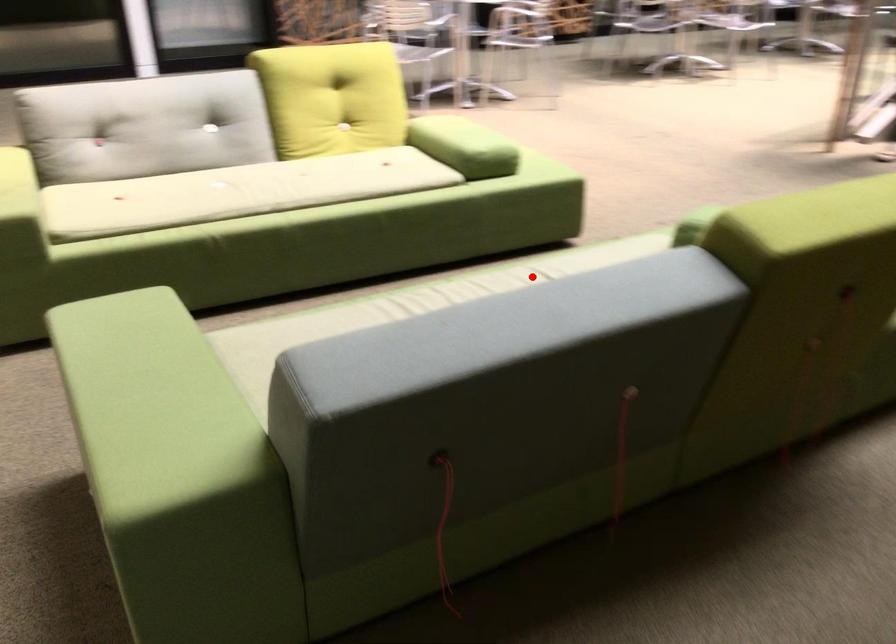
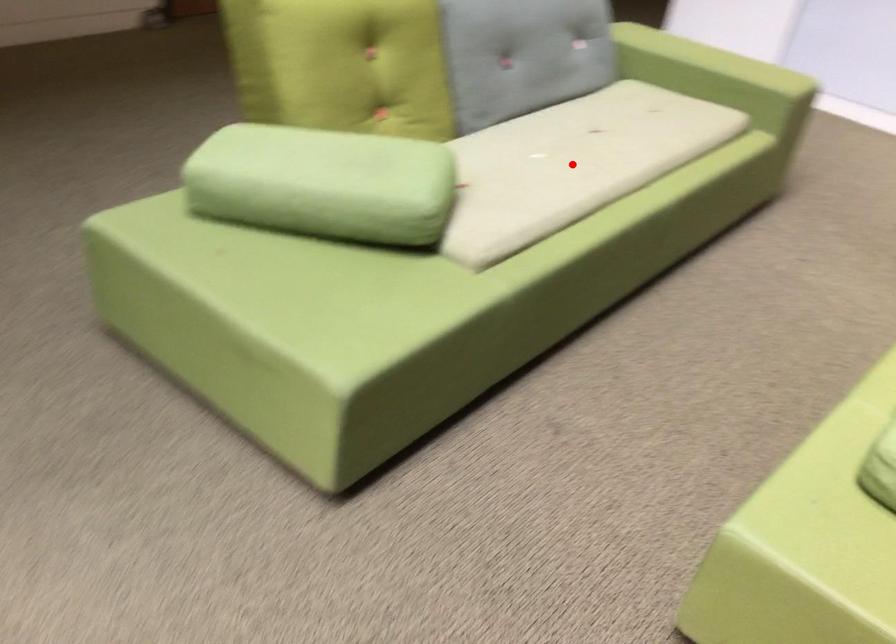
I am providing you with two images of the same scene from different viewpoints. A red point is marked on the first image and another point is marked on the second image. Is the marked point in image1 the same physical position as the marked point in image2?

Yes